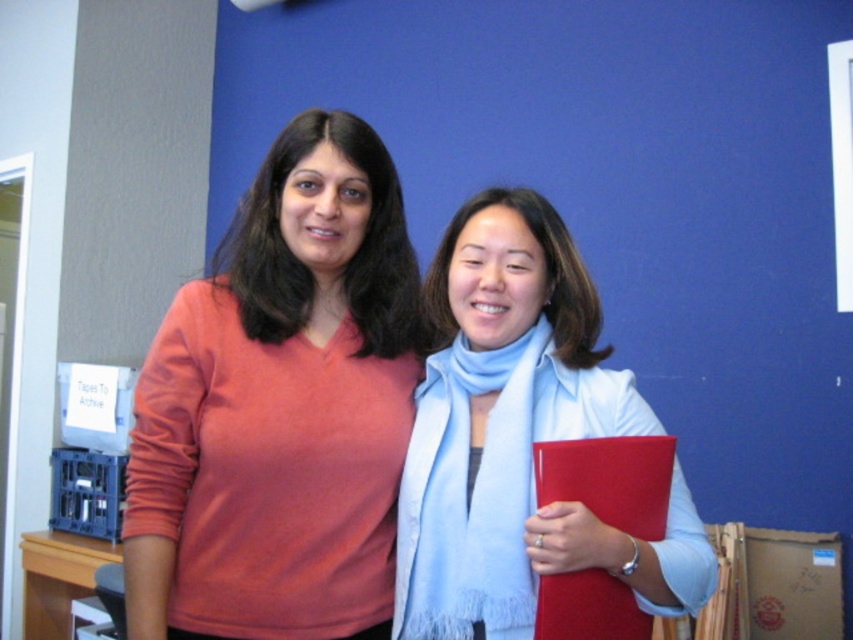
Question: Is light blue scarf at center bigger than light blue soft scarf at center?

Choices:
 (A) no
 (B) yes

Answer: (B)

Question: From the image, what is the correct spatial relationship of matte orange sweater at center in relation to light blue scarf at center?

Choices:
 (A) left
 (B) right

Answer: (A)

Question: Which of these objects is positioned farthest from the light blue scarf at center?

Choices:
 (A) matte orange sweater at center
 (B) light blue soft scarf at center

Answer: (A)

Question: Considering the relative positions of matte orange sweater at center and light blue scarf at center in the image provided, where is matte orange sweater at center located with respect to light blue scarf at center?

Choices:
 (A) above
 (B) below

Answer: (A)

Question: Which object appears farthest from the camera in this image?

Choices:
 (A) light blue soft scarf at center
 (B) light blue scarf at center

Answer: (A)

Question: Among these objects, which one is nearest to the camera?

Choices:
 (A) matte orange sweater at center
 (B) light blue soft scarf at center
 (C) light blue scarf at center

Answer: (C)